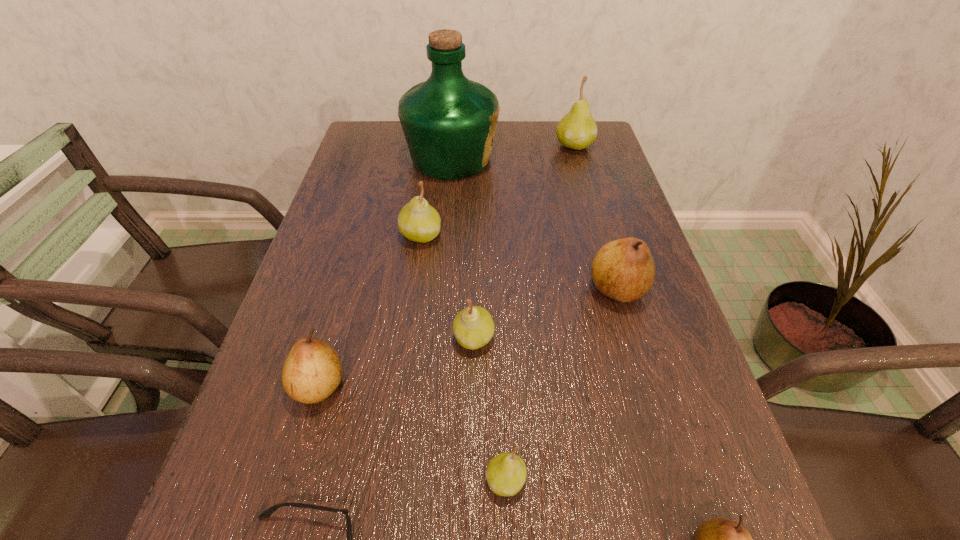
What are the coordinates of `the closest brown pear to the fifth farthest pear` in the screenshot? It's located at (624, 270).

Identify which brown pear is the nearest to the second biggest brown pear. Please provide its 2D coordinates. Your answer should be formatted as a tuple, i.e. [(x, y)], where the tuple contains the x and y coordinates of a point satisfying the conditions above.

[(624, 270)]

Where is `free space in the image that satisfies the following two spatial constraints: 1. on the label side of the liquor; 2. on the left side of the biggest brown pear`? This screenshot has width=960, height=540. free space in the image that satisfies the following two spatial constraints: 1. on the label side of the liquor; 2. on the left side of the biggest brown pear is located at coordinates (441, 289).

Locate an element on the screen. vacant region that satisfies the following two spatial constraints: 1. on the back side of the second smallest brown pear; 2. on the left side of the second smallest green pear is located at coordinates (333, 338).

Where is `vacant space that satisfies the following two spatial constraints: 1. on the front side of the second tallest object; 2. on the right side of the farthest brown pear`? vacant space that satisfies the following two spatial constraints: 1. on the front side of the second tallest object; 2. on the right side of the farthest brown pear is located at coordinates (615, 289).